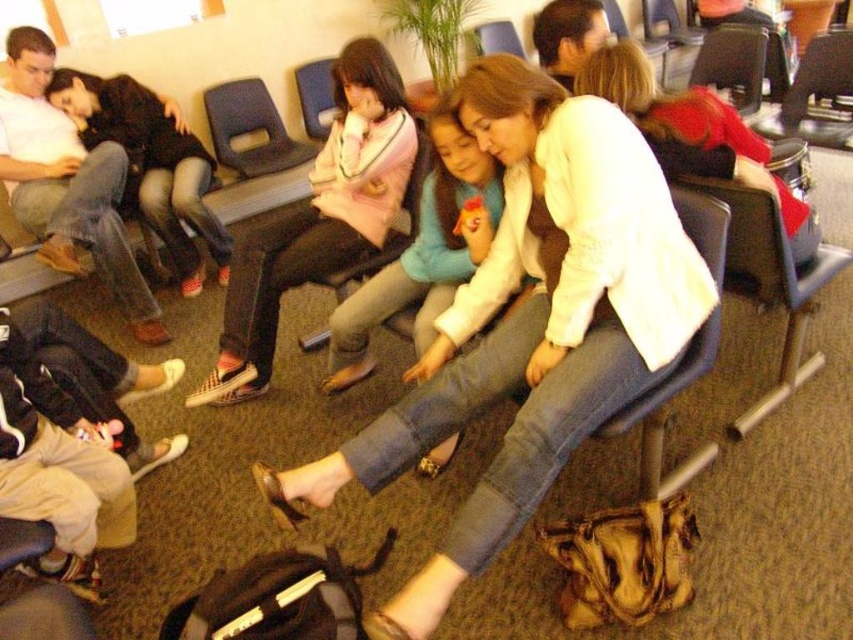
Question: Is matte pink fabric at center further to the viewer compared to wooden chair at center?

Choices:
 (A) no
 (B) yes

Answer: (A)

Question: Does vans sneakers at center appear over matte white blouse at center?

Choices:
 (A) no
 (B) yes

Answer: (B)

Question: From the image, what is the correct spatial relationship of white cotton shirt at center in relation to blue plastic chair at upper center?

Choices:
 (A) above
 (B) below

Answer: (B)

Question: Which of the following is the closest to the observer?

Choices:
 (A) matte white blouse at center
 (B) blue fabric chair at center
 (C) blue plastic chair at center
 (D) wooden chair at center

Answer: (C)

Question: Which object appears closest to the camera in this image?

Choices:
 (A) blue fabric chair at center
 (B) matte black chair at center
 (C) blue plastic chair at center
 (D) matte black jacket at left

Answer: (C)

Question: Which object is positioned farthest from the matte black jacket at left?

Choices:
 (A) vans sneakers at center
 (B) blue fabric chair at center
 (C) blue plastic chair at upper center
 (D) metallic silver chair at upper right

Answer: (D)